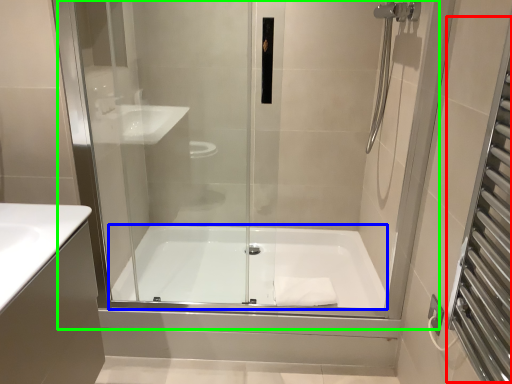
Question: Based on their relative distances, which object is nearer to screen door (highlighted by a red box)? Choose from bathtub (highlighted by a blue box) and shower door (highlighted by a green box).

Choices:
 (A) bathtub
 (B) shower door

Answer: (B)